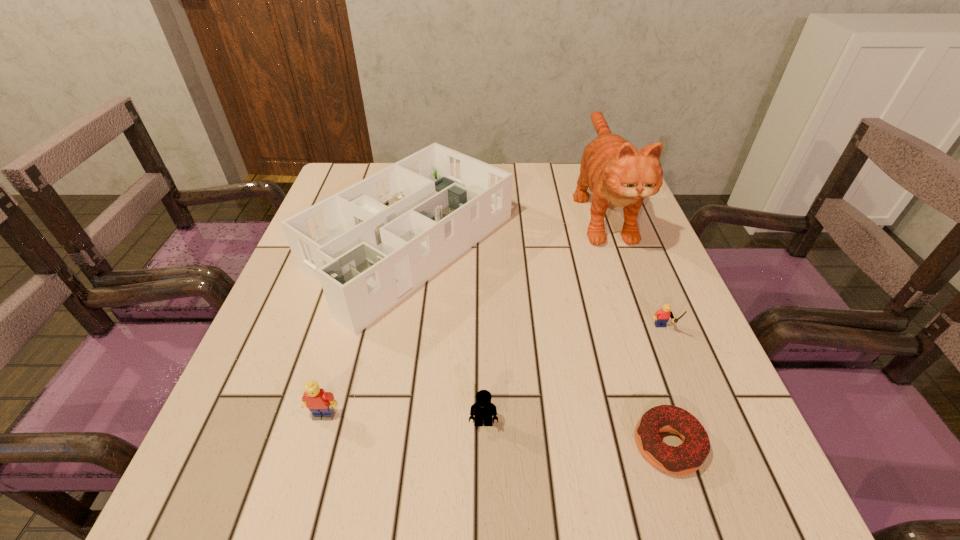
The width and height of the screenshot is (960, 540). In order to click on vacant space located 0.130m on the front-facing side of the second Lego from right to left in this screenshot , I will do `click(484, 518)`.

You are a GUI agent. You are given a task and a screenshot of the screen. Output one action in this format:
    pyautogui.click(x=<x>, y=<y>)
    Task: Click on the free point located on the left of the shortest object
    Image resolution: width=960 pixels, height=540 pixels.
    Given the screenshot: What is the action you would take?
    pyautogui.click(x=403, y=445)

This screenshot has height=540, width=960. Identify the location of cat located in the far edge section of the desktop. (617, 174).

The height and width of the screenshot is (540, 960). Find the location of `dollhouse that is at the far edge`. dollhouse that is at the far edge is located at coordinates (372, 244).

Identify the location of object that is at the near edge. The image size is (960, 540). (688, 457).

Image resolution: width=960 pixels, height=540 pixels. What are the coordinates of `dollhouse present at the left edge` in the screenshot? It's located at (372, 244).

The image size is (960, 540). Identify the location of Lego at the left edge. (320, 403).

Identify the location of cat located at the right edge. The image size is (960, 540). (617, 174).

Where is `Lego that is at the right edge`? The height and width of the screenshot is (540, 960). Lego that is at the right edge is located at coordinates (662, 316).

Locate an element on the screen. doughnut at the right edge is located at coordinates (688, 457).